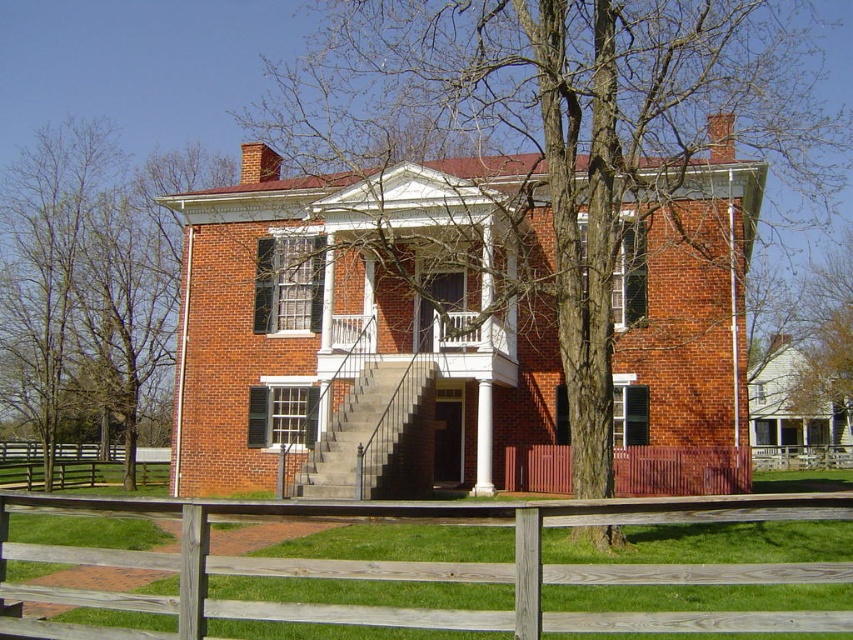
Can you confirm if brown wooden fence at lower left is thinner than white smooth column at center?

Incorrect, brown wooden fence at lower left's width is not less than white smooth column at center's.

Does point (90, 449) come closer to viewer compared to point (480, 474)?

No.

The image size is (853, 640). I want to click on brown wooden fence at lower left, so click(86, 465).

Is the position of brown bark tree at center more distant than that of brown wooden fence at lower left?

No, it is in front of brown wooden fence at lower left.

Between brown bark tree at center and brown wooden fence at lower left, which one has less height?

brown wooden fence at lower left is shorter.

Image resolution: width=853 pixels, height=640 pixels. In order to click on brown bark tree at center in this screenshot , I will do `click(90, 280)`.

Is bare wood tree at center below brown bark tree at center?

No.

Based on the photo, can you confirm if bare wood tree at center is taller than brown bark tree at center?

Correct, bare wood tree at center is much taller as brown bark tree at center.

Who is more forward, (766, 40) or (33, 147)?

Point (766, 40) is more forward.

Where is `bare wood tree at center`? bare wood tree at center is located at coordinates (569, 129).